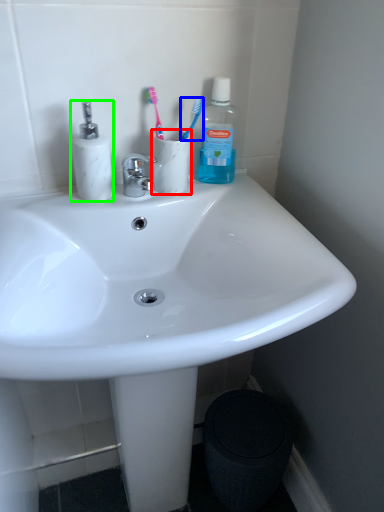
Question: Which object is positioned closest to coffee cup (highlighted by a red box)? Select from toothbrush (highlighted by a blue box) and toiletries (highlighted by a green box).

Choices:
 (A) toothbrush
 (B) toiletries

Answer: (A)